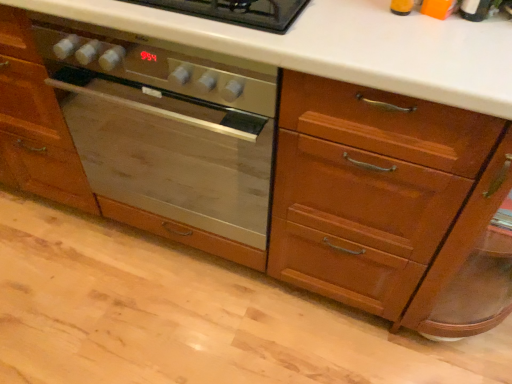
I want to click on satin silver oven at center, so click(169, 135).

The height and width of the screenshot is (384, 512). What do you see at coordinates (169, 135) in the screenshot? I see `satin silver oven at center` at bounding box center [169, 135].

Identify the location of satin silver oven at center. (169, 135).